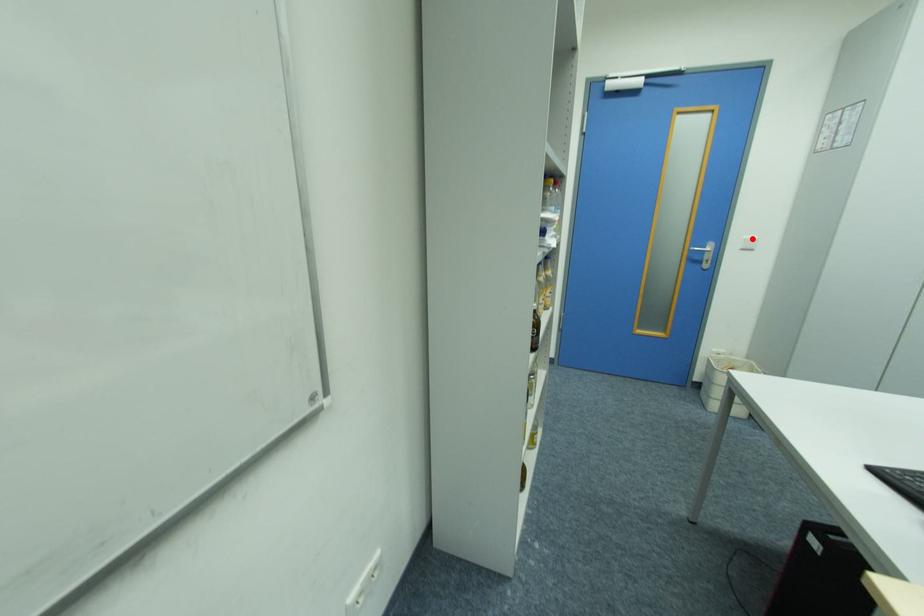
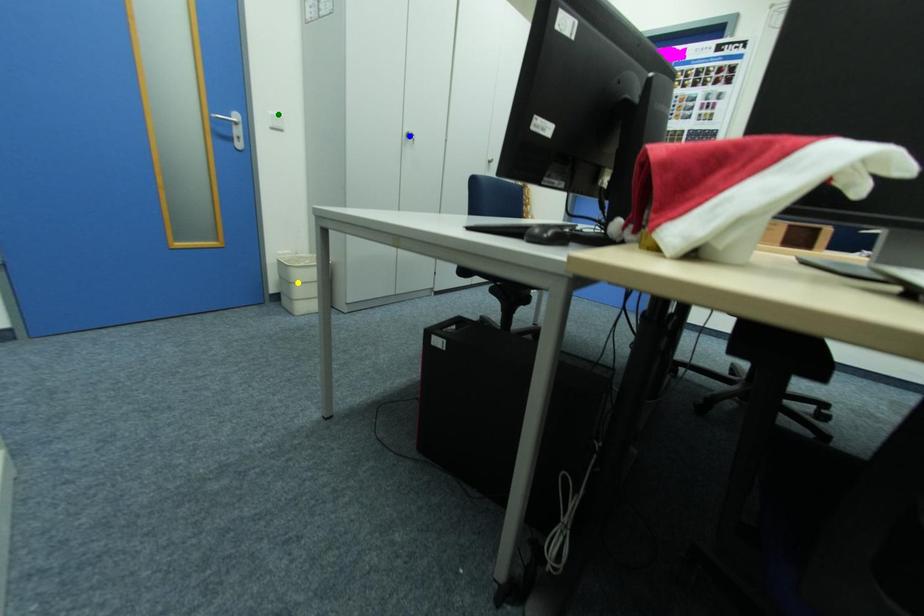
Question: I am providing you with two images of the same scene from different viewpoints. A red point is marked on the first image. You are given multiple points on the second image. Which point in image 2 is actually the same real-world point as the red point in image 1?

Choices:
 (A) green point
 (B) blue point
 (C) yellow point

Answer: (A)